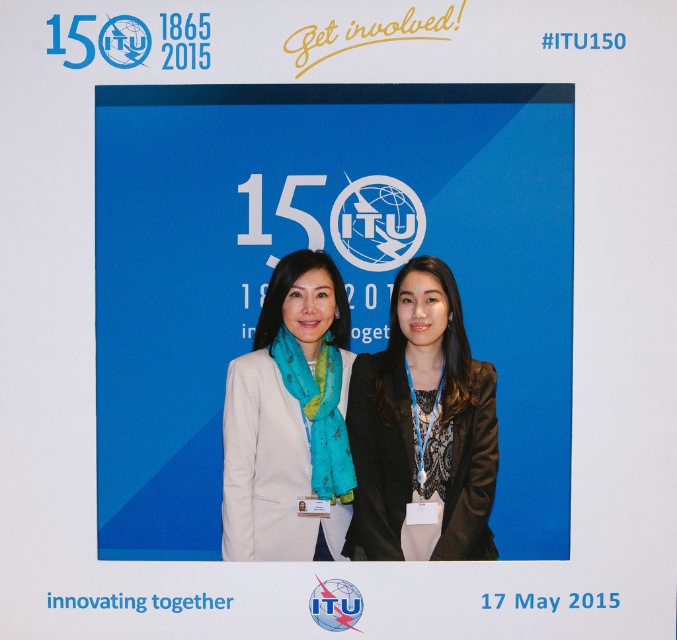
What is the 2D coordinate of the black lace blazer at center?

The 2D coordinate of the black lace blazer at center is at point (414, 426).

You are a photographer adjusting the focus of your camera. You need to focus on both the point at (431, 394) and the point at (274, 490). Which point should you focus on first to ensure both are in focus?

You should focus on point (431, 394) first because it is closer to the camera than point (274, 490). This ensures that the depth of field will cover both points effectively.

You are attending the ITU 150th anniversary event and notice two individuals in the foreground wearing blazers. Which blazer is to the right of the other? The black lace blazer at center or the matte white blazer at center?

The black lace blazer at center is positioned on the right side of the matte white blazer at center.